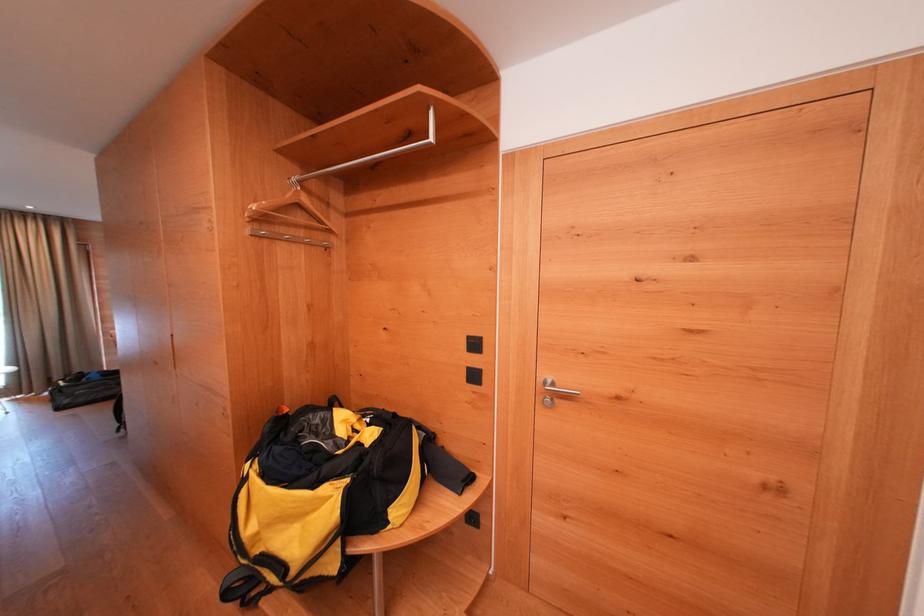
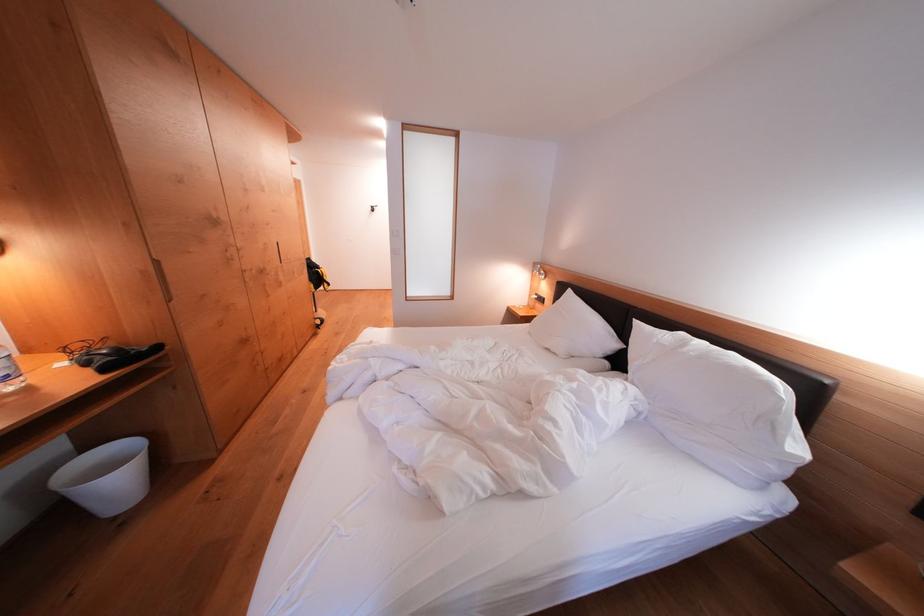
Question: I am providing you with two images of the same scene from different viewpoints. After the viewpoint changes to image2, which objects are now occluded?

Choices:
 (A) camera tripod
 (B) metal clothes rod
 (C) black coat hook
 (D) white trash can

Answer: (B)